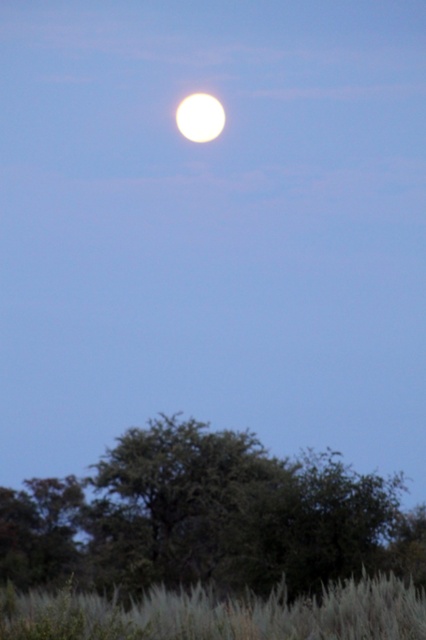
Based on the photo, between silvery grass at lower center and bright white sphere at upper center, which one appears on the left side from the viewer's perspective?

Positioned to the left is bright white sphere at upper center.

Between point (348, 600) and point (178, 116), which one is positioned in front?

Point (348, 600) is in front.

Measure the distance between silvery grass at lower center and camera.

silvery grass at lower center and camera are 9.91 meters apart.

What are the coordinates of `silvery grass at lower center` in the screenshot? It's located at (221, 612).

Can you confirm if green leafy tree at lower center is positioned to the left of bright white sphere at upper center?

Incorrect, green leafy tree at lower center is not on the left side of bright white sphere at upper center.

Does green leafy tree at lower center appear over bright white sphere at upper center?

No, green leafy tree at lower center is not above bright white sphere at upper center.

What do you see at coordinates (207, 516) in the screenshot? I see `green leafy tree at lower center` at bounding box center [207, 516].

Where is `green leafy tree at lower center`? green leafy tree at lower center is located at coordinates (207, 516).

Does point (135, 452) come farther from viewer compared to point (69, 612)?

Yes.

Locate an element on the screen. green leafy tree at lower center is located at coordinates (207, 516).

At what (x,y) coordinates should I click in order to perform the action: click on green leafy tree at lower center. Please return your answer as a coordinate pair (x, y). Image resolution: width=426 pixels, height=640 pixels. Looking at the image, I should click on (207, 516).